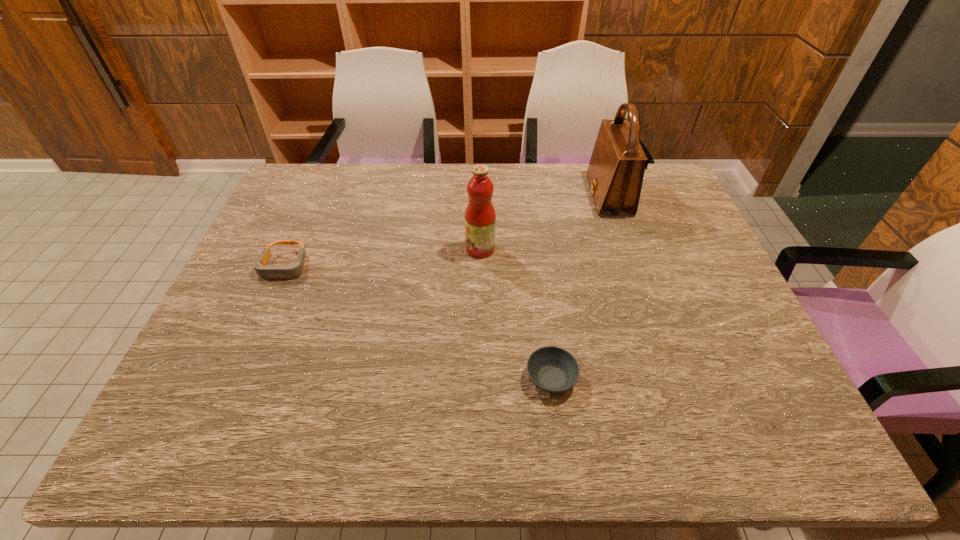
The image size is (960, 540). In order to click on the farthest object in this screenshot , I will do `click(615, 174)`.

Image resolution: width=960 pixels, height=540 pixels. What are the coordinates of `shoulder bag` in the screenshot? It's located at (615, 174).

Where is `fruit juice`? This screenshot has width=960, height=540. fruit juice is located at coordinates (480, 217).

This screenshot has height=540, width=960. I want to click on the third object from right to left, so click(x=480, y=217).

The height and width of the screenshot is (540, 960). What are the coordinates of `the leftmost object` in the screenshot? It's located at (294, 270).

Identify the location of the nearest object. The image size is (960, 540). (552, 369).

The image size is (960, 540). What are the coordinates of `the third object from left to right` in the screenshot? It's located at (552, 369).

In order to click on vacant region located 0.300m on the front flap of the rightmost object in this screenshot , I will do `click(498, 196)`.

Identify the location of vacant space located 0.210m on the front flap of the rightmost object. This screenshot has height=540, width=960. (525, 196).

What are the coordinates of `blank area located 0.360m on the front flap of the rightmost object` in the screenshot? It's located at (479, 196).